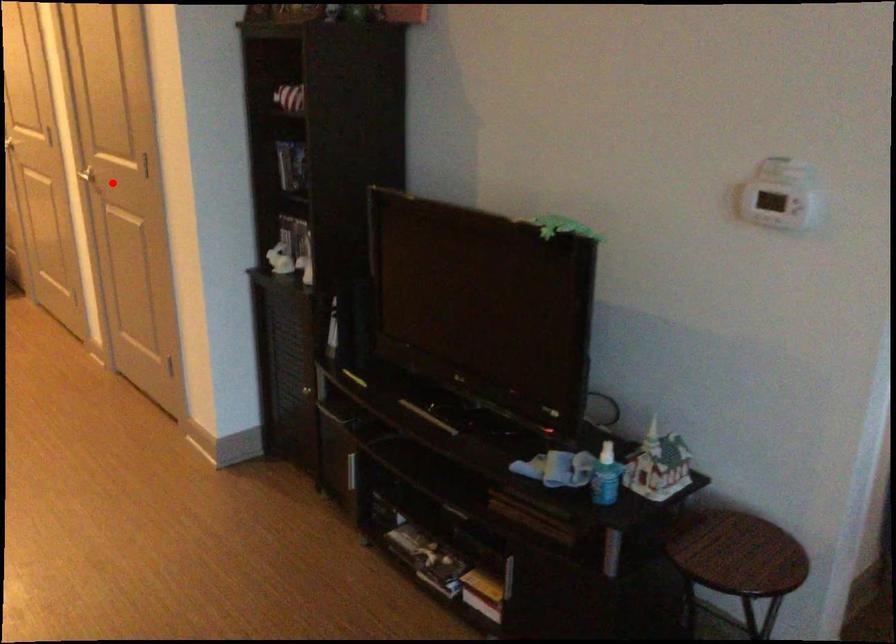
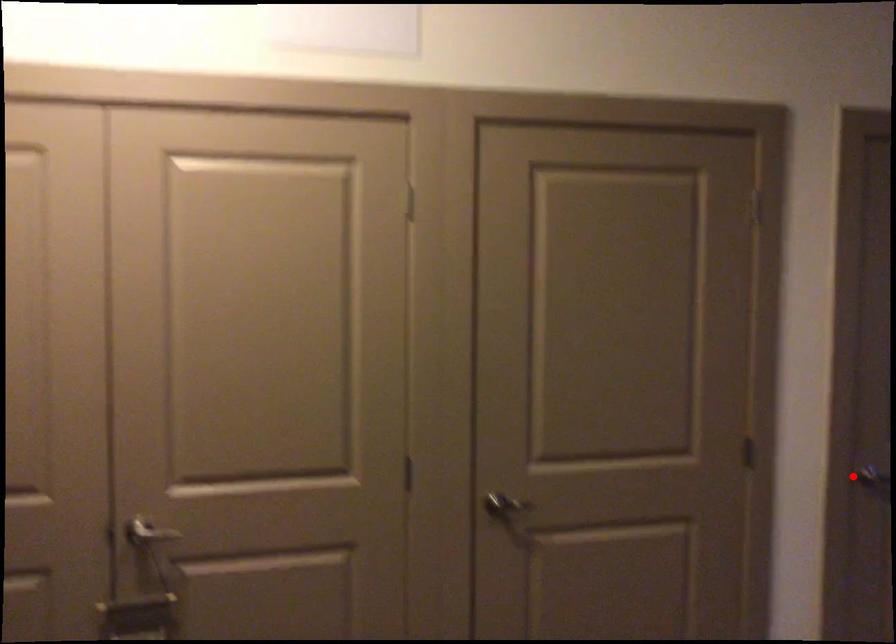
I am providing you with two images of the same scene from different viewpoints. A red point is marked on the first image and another point is marked on the second image. Does the point marked in image1 correspond to the same location as the one in image2?

Yes